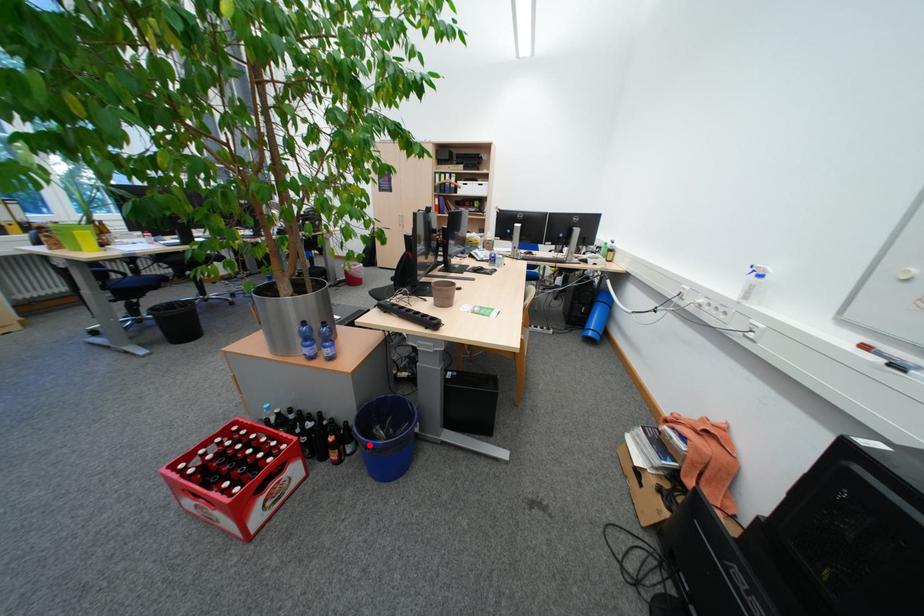
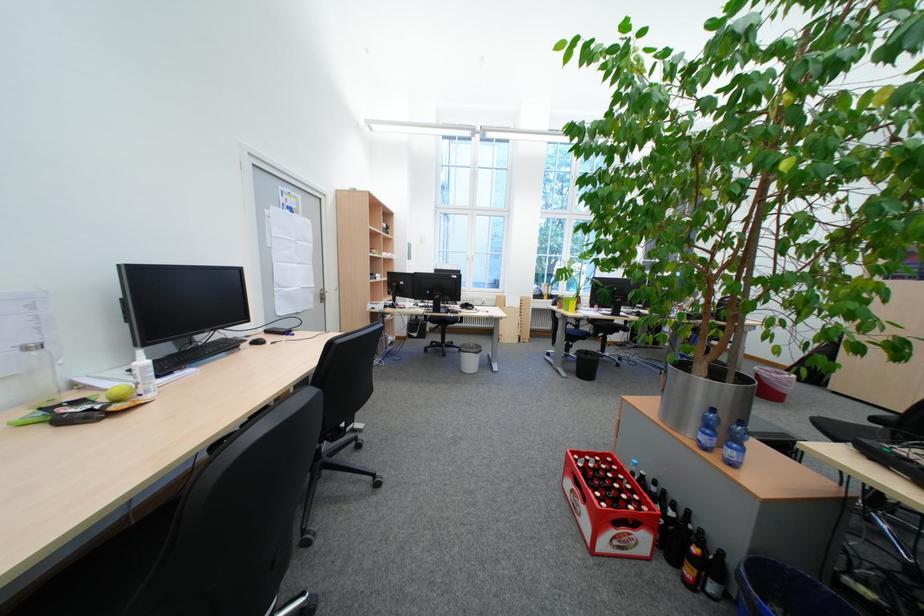
Question: A red point is marked in image1. In image2, is the corresponding 3D point closer to the camera or farther? Reply with the corresponding letter.

Choices:
 (A) The corresponding 3D point is closer.
 (B) The corresponding 3D point is farther.

Answer: (A)